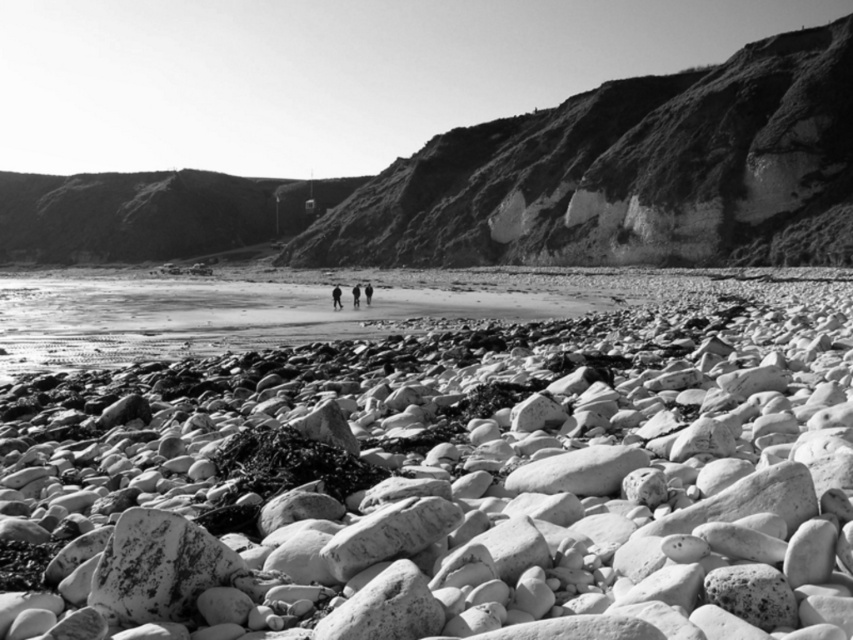
Between rough textured cliff at upper right and dark fabric pants at center, which one is positioned higher?

rough textured cliff at upper right is higher up.

Is rough textured cliff at upper right closer to the viewer compared to dark fabric pants at center?

No, it is behind dark fabric pants at center.

Who is more forward, (498, 147) or (364, 296)?

Positioned in front is point (364, 296).

You are a GUI agent. You are given a task and a screenshot of the screen. Output one action in this format:
    pyautogui.click(x=<x>, y=<y>)
    Task: Click on the rough textured cliff at upper right
    This screenshot has width=853, height=640.
    Given the screenshot: What is the action you would take?
    pyautogui.click(x=627, y=173)

Does dark fabric figure at center have a lesser height compared to smooth skin person at center?

No.

Is dark fabric figure at center below smooth skin person at center?

Indeed, dark fabric figure at center is positioned under smooth skin person at center.

The height and width of the screenshot is (640, 853). Find the location of `dark fabric figure at center`. dark fabric figure at center is located at coordinates (335, 296).

Is point (223, 509) behind point (370, 285)?

That is False.

Between point (560, 506) and point (364, 284), which one is positioned in front?

Point (560, 506)

At what (x,y) coordinates should I click in order to perform the action: click on smooth pebbles at center. Please return your answer as a coordinate pair (x, y). Image resolution: width=853 pixels, height=640 pixels. Looking at the image, I should click on (444, 486).